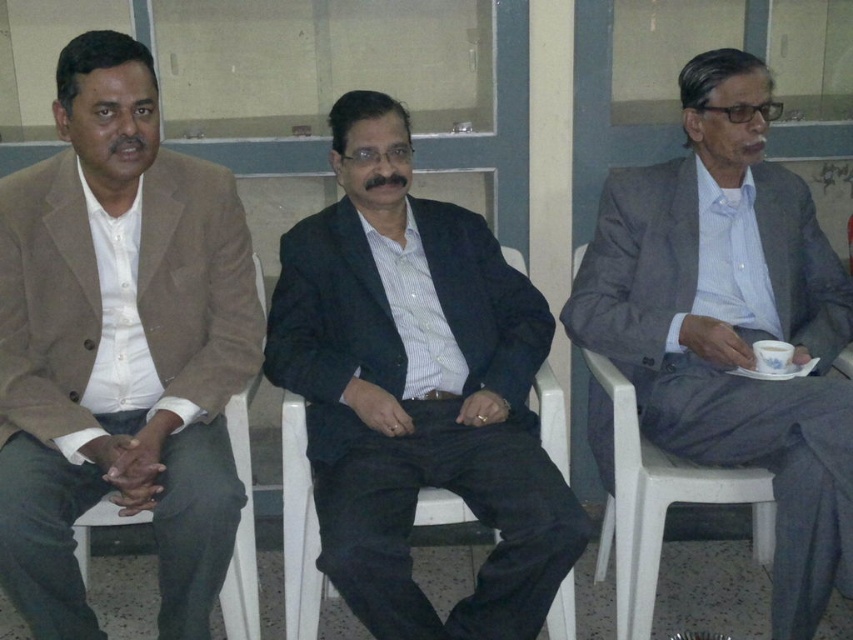
Can you confirm if dark blue suit at center is smaller than white ceramic cup at center right?

Actually, dark blue suit at center might be larger than white ceramic cup at center right.

Who is higher up, dark blue suit at center or white ceramic cup at center right?

Positioned higher is dark blue suit at center.

Who is more distant from viewer, (375,572) or (759,344)?

The point (759,344) is behind.

At what (x,y) coordinates should I click in order to perform the action: click on dark blue suit at center. Please return your answer as a coordinate pair (x, y). This screenshot has width=853, height=640. Looking at the image, I should click on (416, 388).

From the picture: Does gray fabric suit at right have a larger size compared to white ceramic cup at center right?

Indeed, gray fabric suit at right has a larger size compared to white ceramic cup at center right.

Can you confirm if gray fabric suit at right is positioned to the left of white ceramic cup at center right?

Correct, you'll find gray fabric suit at right to the left of white ceramic cup at center right.

Locate an element on the screen. The image size is (853, 640). gray fabric suit at right is located at coordinates (730, 321).

Who is more distant from viewer, (392, 180) or (109, 524)?

Positioned behind is point (392, 180).

At what (x,y) coordinates should I click in order to perform the action: click on dark blue suit at center. Please return your answer as a coordinate pair (x, y). The height and width of the screenshot is (640, 853). Looking at the image, I should click on (416, 388).